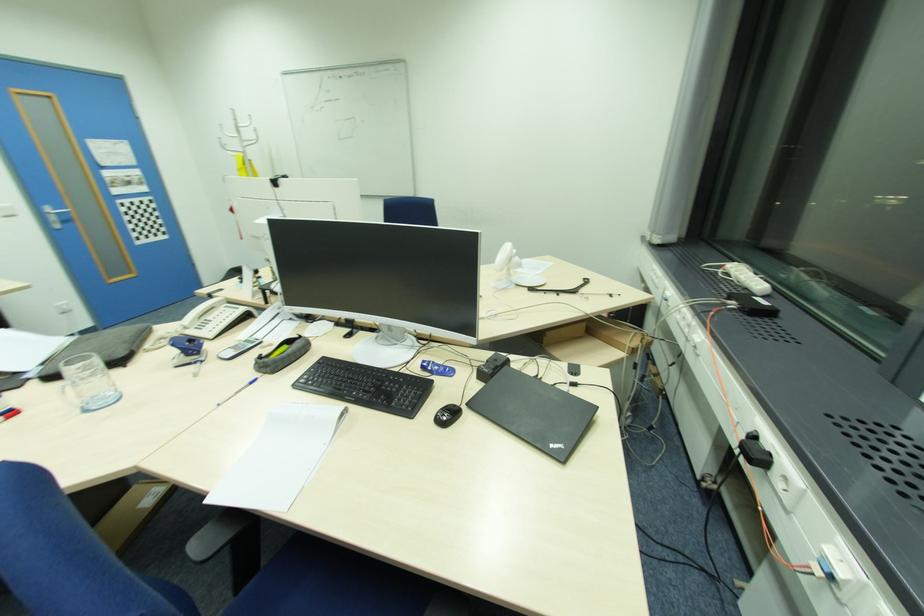
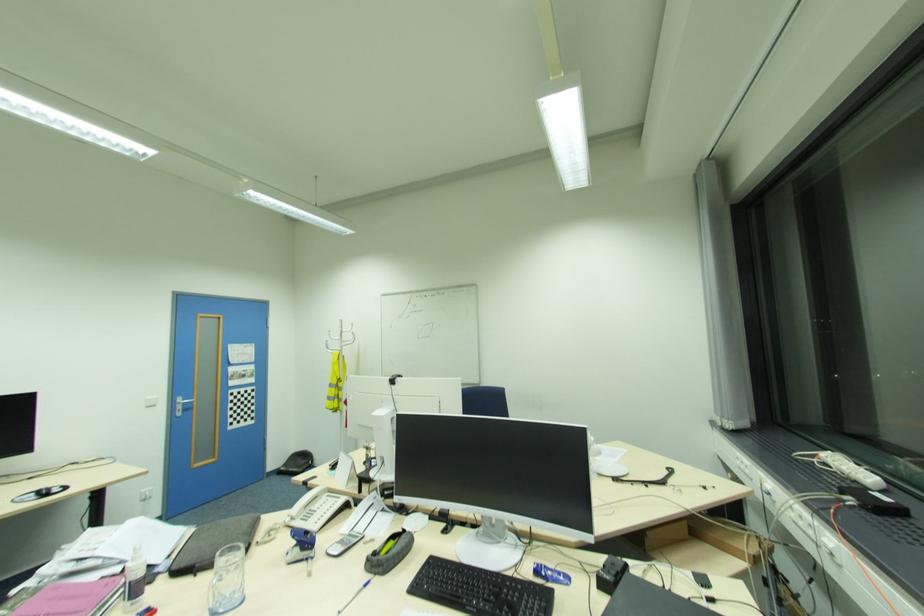
Locate, in the second image, the point that corresponds to pixel 70 363 in the first image.

(225, 554)